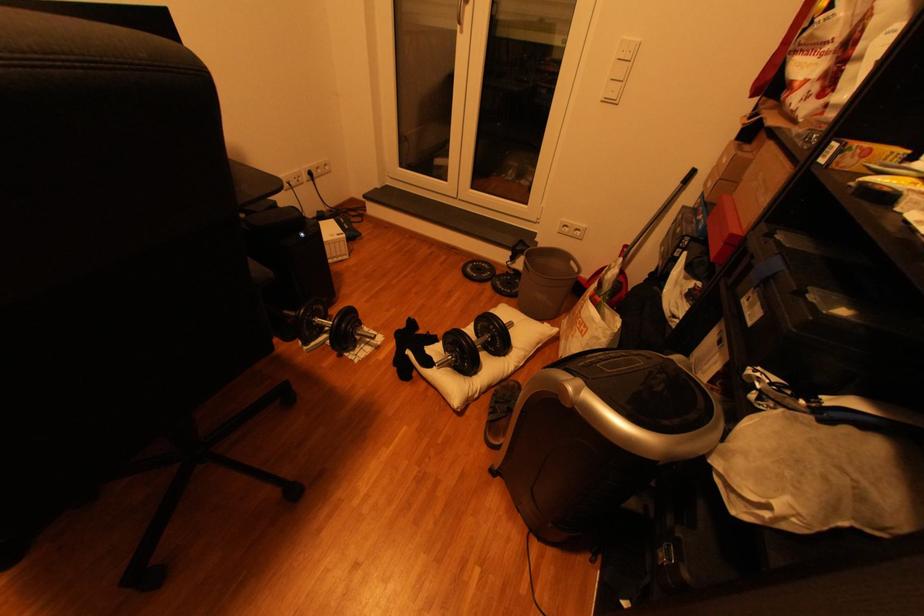
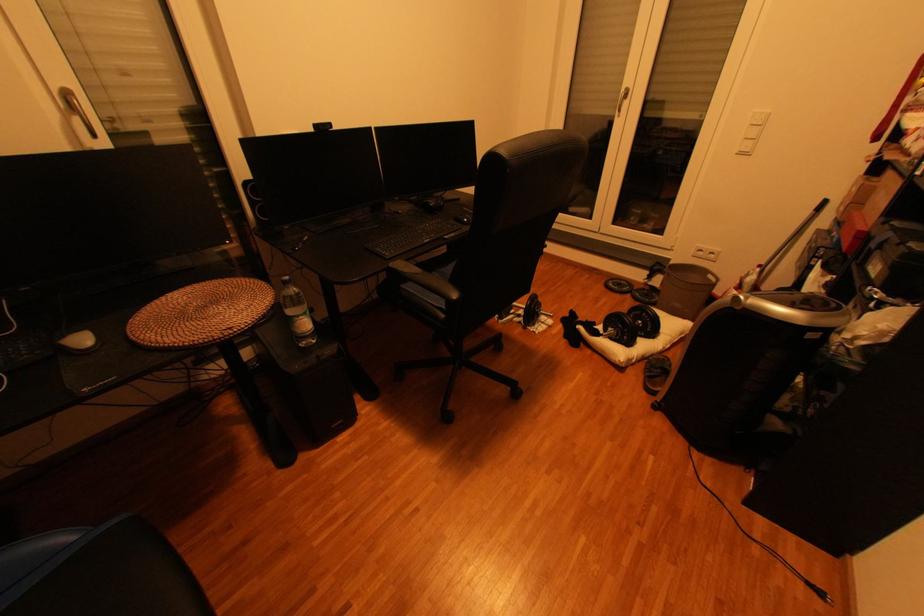
In the second image, find the point that corresponds to pixel 518 292 in the first image.

(658, 301)